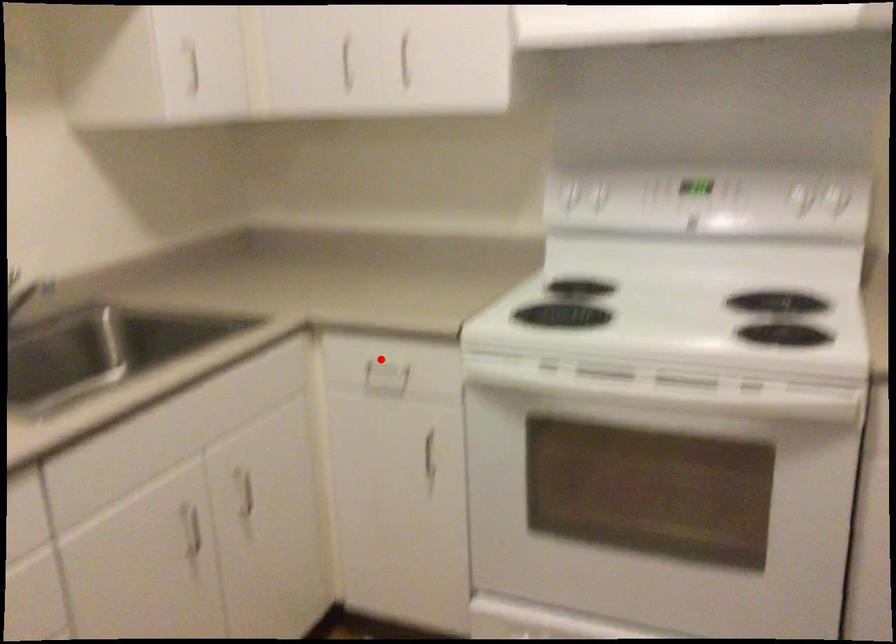
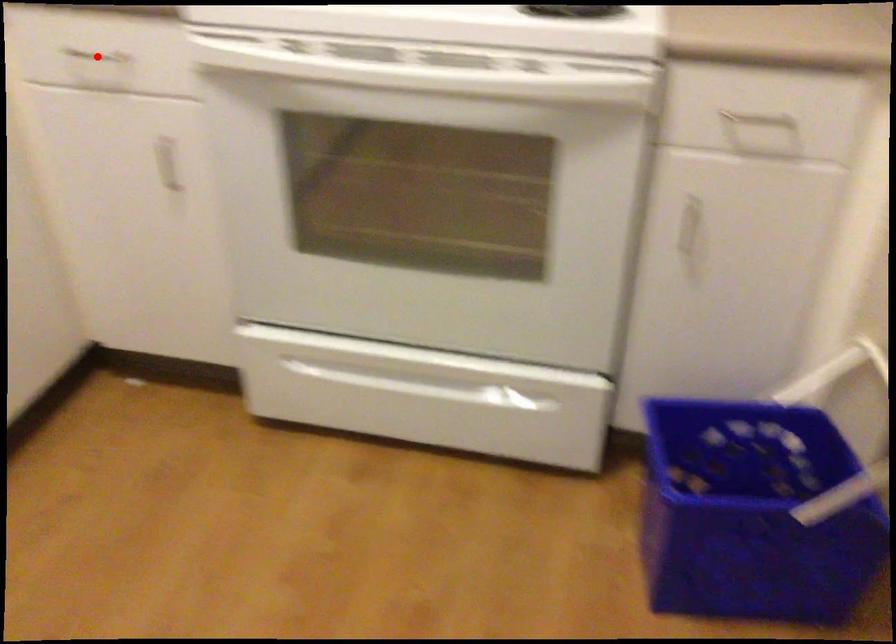
From the picture: I am providing you with two images of the same scene from different viewpoints. A red point is marked on the first image and another point is marked on the second image. Is the red point in image1 aligned with the point shown in image2?

Yes